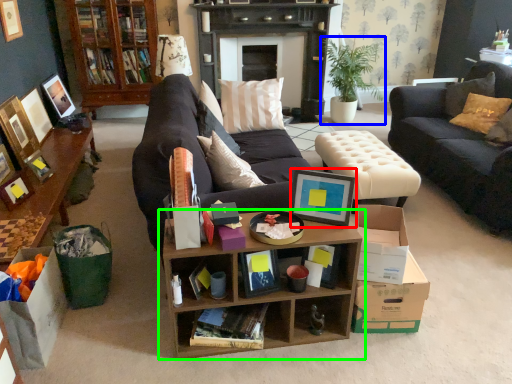
Question: Considering the real-world distances, which object is closest to picture frame (highlighted by a red box)? houseplant (highlighted by a blue box) or shelf (highlighted by a green box).

Choices:
 (A) houseplant
 (B) shelf

Answer: (B)